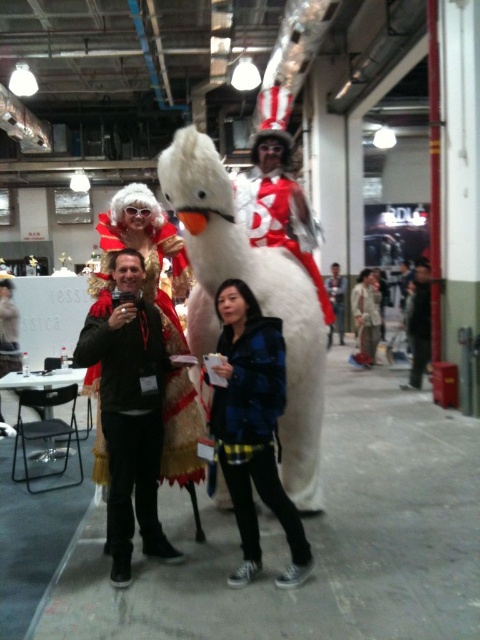
You are at the event and want to take a photo of the white plush swan at center and the white plush horse at center. Which one is closer to the camera?

The white plush swan at center is positioned under the white plush horse at center, so the white plush horse at center is closer to the camera.

You are attending an event and see the black matte jacket at center and the matte gold helmet at center in the image. Which object is positioned lower in the scene?

The black matte jacket at center is located below the matte gold helmet at center, so it is positioned lower in the scene.

You are standing in the convention hall and want to take a closer look at the white plush swan at center. If you walk 2 meters towards it, will you be able to touch it?

The white plush swan at center is initially 2.50 meters away. After walking 2 meters closer, you would be 0.50 meters away, so yes, you can touch it.